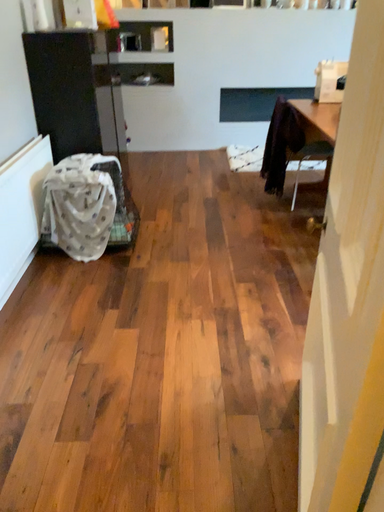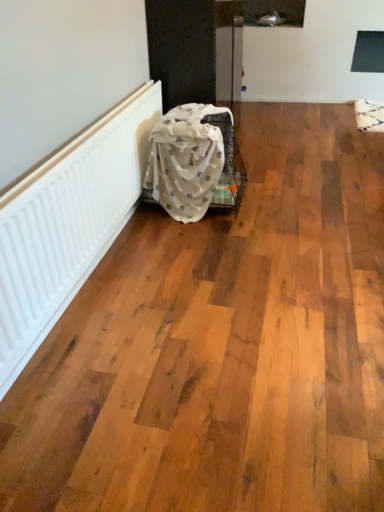
Question: Which way did the camera rotate in the video?

Choices:
 (A) rotated left
 (B) rotated right

Answer: (A)